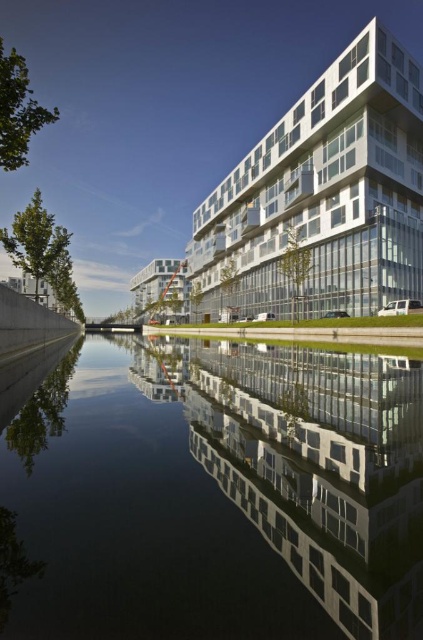
You are a drone operator trying to fly a drone with a 1.2 meter wingspan between the transparent glass waterway at center and the white glass building at upper center. Based on the scene description, can the drone safely pass through the space between them?

The transparent glass waterway at center is narrower than the white glass building at upper center. Since the drone has a 1.2 meter wingspan, it depends on the actual width of the waterway. However, since the waterway is narrower, there might not be enough space for the drone to pass safely. Without exact measurements, it is risky to attempt the maneuver.

You are an architect designing a new park near the transparent glass waterway at center and the white glass building at upper center. Which of the two structures would require more space in the park layout?

The white glass building at upper center requires more space in the park layout since it is larger than the transparent glass waterway at center according to the description.

You are an architect designing a new park near the transparent glass waterway at center and the white glass building at upper center. To ensure visitors can see both the waterway and the building clearly, where should you place the benches?

The transparent glass waterway at center is below the white glass building at upper center, so placing benches at the lower area near the transparent glass waterway at center will allow visitors to look up and see both the waterway and the building clearly.